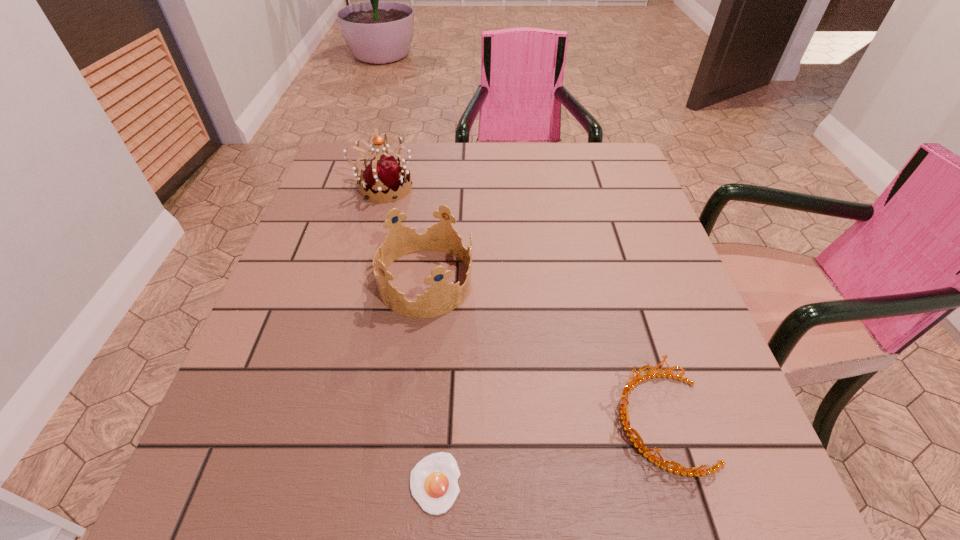
The width and height of the screenshot is (960, 540). In order to click on empty space between the tallest tiara and the egg yolk in this screenshot , I will do `click(409, 335)`.

I want to click on free space between the shortest object and the farthest tiara, so [409, 335].

The width and height of the screenshot is (960, 540). I want to click on vacant space that's between the third nearest object and the egg yolk, so click(430, 382).

Identify the location of free space between the shortest object and the second tallest object. This screenshot has width=960, height=540. (430, 382).

This screenshot has width=960, height=540. Find the location of `the closest object to the farthest tiara`. the closest object to the farthest tiara is located at coordinates (443, 297).

Where is `object identified as the second closest to the second tallest object`? object identified as the second closest to the second tallest object is located at coordinates (433, 480).

Locate which tiara is the second closest to the shortest tiara. Please provide its 2D coordinates. Your answer should be formatted as a tuple, i.e. [(x, y)], where the tuple contains the x and y coordinates of a point satisfying the conditions above.

[(384, 175)]

Locate an element on the screen. The width and height of the screenshot is (960, 540). the second closest tiara relative to the second shortest object is located at coordinates (384, 175).

What are the coordinates of `blank area in the image that satisfies the following two spatial constraints: 1. on the front-facing side of the egg yolk; 2. on the right side of the second tallest object` in the screenshot? It's located at (400, 483).

Locate an element on the screen. The image size is (960, 540). vacant space that satisfies the following two spatial constraints: 1. on the front-facing side of the tallest object; 2. on the right side of the shortest object is located at coordinates (305, 483).